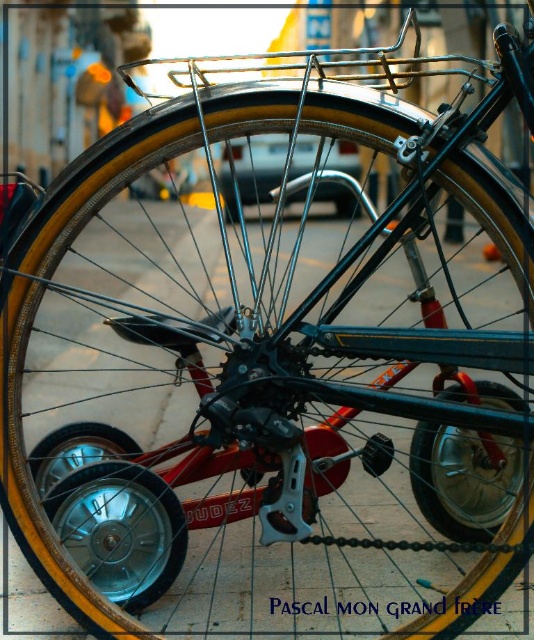
Question: Is shiny metallic wheel at lower left behind shiny metallic tire at center?

Choices:
 (A) no
 (B) yes

Answer: (B)

Question: Which of the following is the closest to the observer?

Choices:
 (A) (96, 538)
 (B) (511, 445)

Answer: (A)

Question: Is shiny metallic wheel at lower left to the left of shiny metallic tire at center from the viewer's perspective?

Choices:
 (A) no
 (B) yes

Answer: (B)

Question: Which point appears farthest from the camera in this image?

Choices:
 (A) (433, 458)
 (B) (84, 486)

Answer: (A)

Question: Which of the following is the farthest from the observer?

Choices:
 (A) (136, 611)
 (B) (478, 538)

Answer: (B)

Question: Can you confirm if shiny metallic wheel at lower left is positioned below shiny metallic tire at center?

Choices:
 (A) no
 (B) yes

Answer: (B)